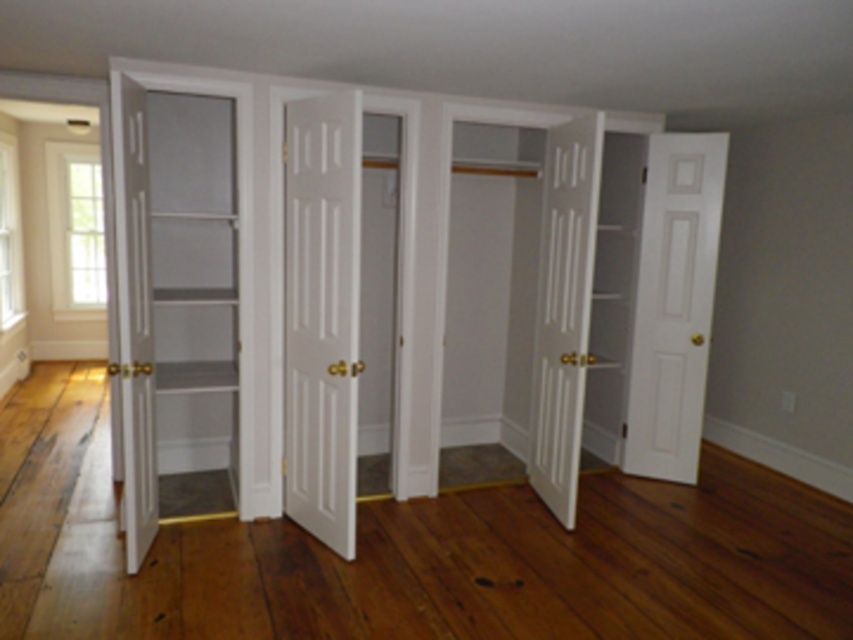
Question: Among these points, which one is nearest to the camera?

Choices:
 (A) (134, 125)
 (B) (540, 420)
 (C) (654, 355)
 (D) (341, 282)

Answer: (A)

Question: Does white matte closet doors at center have a larger size compared to white wood door at right?

Choices:
 (A) no
 (B) yes

Answer: (B)

Question: Which of these objects is positioned closest to the white smooth door at center?

Choices:
 (A) white glossy door at left
 (B) white matte door at right

Answer: (A)

Question: Is white smooth door at center above white matte door at right?

Choices:
 (A) no
 (B) yes

Answer: (A)

Question: Which object is closer to the camera taking this photo?

Choices:
 (A) white smooth door at center
 (B) white matte closet doors at center
 (C) white wood door at right
 (D) white matte door at right

Answer: (A)

Question: Does white smooth door at center appear on the left side of white glossy door at left?

Choices:
 (A) no
 (B) yes

Answer: (A)